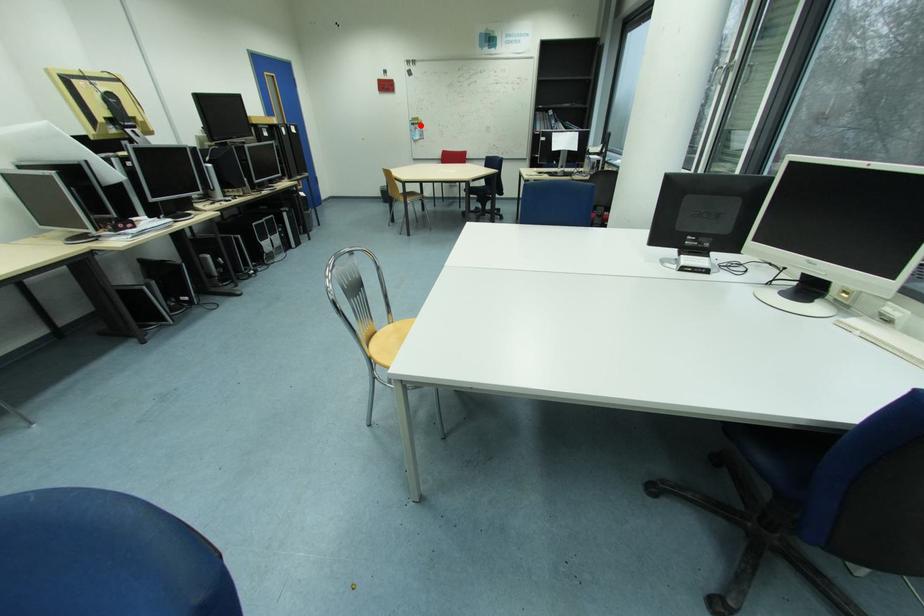
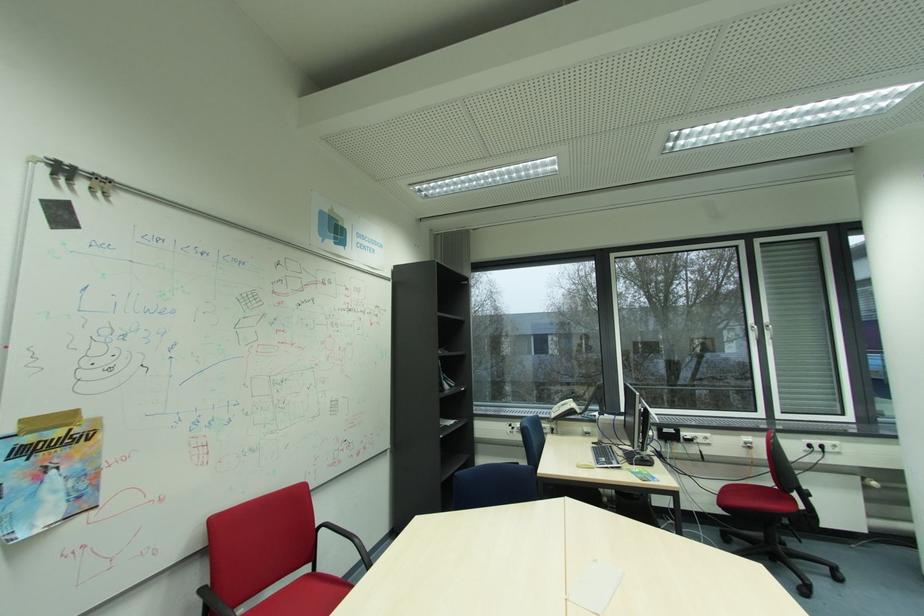
Where in the second image is the point corresponding to the highlighted location from the first image?

(31, 452)